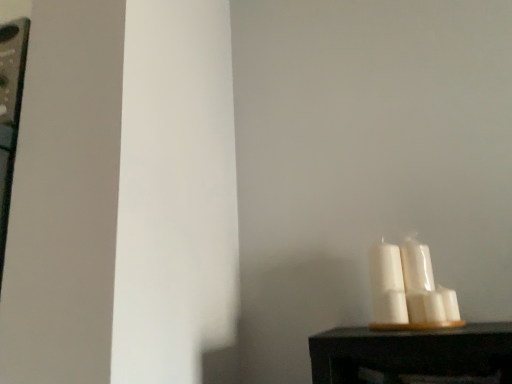
Question: Is white matte candle at lower right, which ranks as the first candle in right-to-left order, wider or thinner than white glossy candle at right, which is counted as the second candle, starting from the right?

Choices:
 (A) thin
 (B) wide

Answer: (A)

Question: From the image's perspective, is white matte candle at lower right, which ranks as the first candle in right-to-left order, above or below white glossy candle at right, which ranks as the first candle in left-to-right order?

Choices:
 (A) above
 (B) below

Answer: (B)

Question: Does point (454, 311) appear closer or farther from the camera than point (387, 251)?

Choices:
 (A) closer
 (B) farther

Answer: (A)

Question: Does point (381, 322) appear closer or farther from the camera than point (455, 296)?

Choices:
 (A) farther
 (B) closer

Answer: (B)

Question: In the image, is white glossy candle at right, which is counted as the second candle, starting from the right, positioned in front of or behind white matte candle at lower right, the second candle viewed from the left?

Choices:
 (A) behind
 (B) front

Answer: (A)

Question: Looking at the image, does white glossy candle at right, which is counted as the second candle, starting from the right, seem bigger or smaller compared to white matte candle at lower right, the second candle viewed from the left?

Choices:
 (A) small
 (B) big

Answer: (B)

Question: Considering the positions of white glossy candle at right, which ranks as the first candle in left-to-right order, and white matte candle at lower right, which ranks as the first candle in right-to-left order, in the image, is white glossy candle at right, which ranks as the first candle in left-to-right order, taller or shorter than white matte candle at lower right, which ranks as the first candle in right-to-left order,?

Choices:
 (A) short
 (B) tall

Answer: (B)